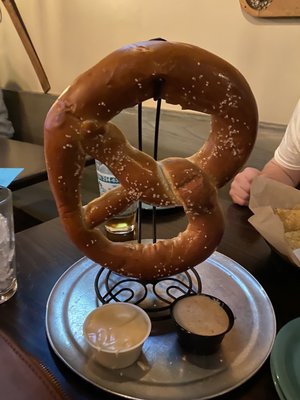
Where is `glass`? This screenshot has width=300, height=400. glass is located at coordinates (10, 247).